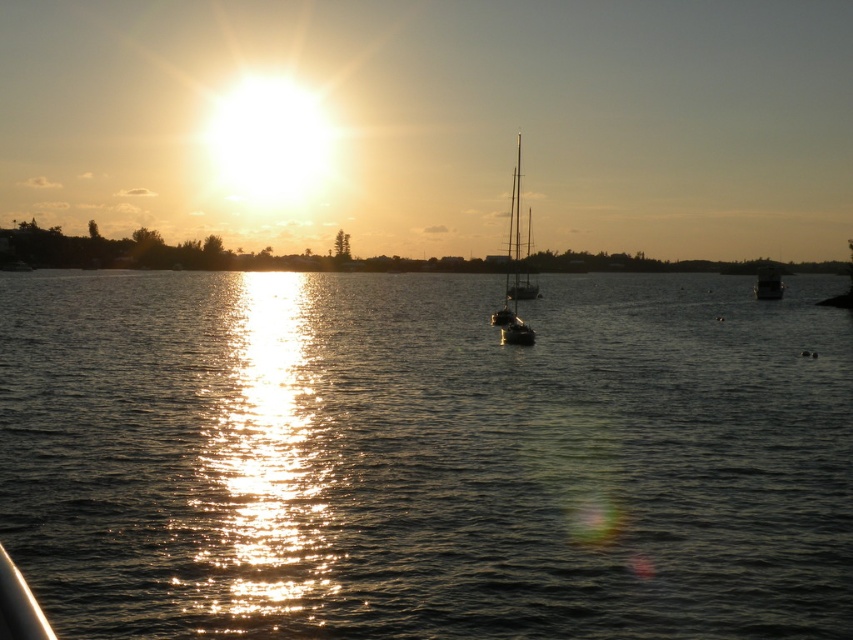
Who is more distant from viewer, (28, 532) or (776, 273)?

Positioned behind is point (776, 273).

Describe the element at coordinates (424, 456) in the screenshot. I see `shiny reflective water at center` at that location.

Does point (816, 320) come in front of point (781, 289)?

Yes, point (816, 320) is closer to viewer.

At what (x,y) coordinates should I click in order to perform the action: click on shiny reflective water at center. Please return your answer as a coordinate pair (x, y). This screenshot has height=640, width=853. Looking at the image, I should click on (424, 456).

Who is more forward, (596, 301) or (512, 236)?

Point (512, 236) is more forward.

Who is lower down, shiny reflective water at center or silhouette sailboat at center?

shiny reflective water at center is below.

Is point (814, 412) positioned before point (518, 262)?

That is True.

Where is `shiny reflective water at center`? This screenshot has height=640, width=853. shiny reflective water at center is located at coordinates (424, 456).

Who is taller, silhouette sailboat at center or metallic silver boat at right?

silhouette sailboat at center

Looking at this image, is silhouette sailboat at center taller than metallic silver boat at right?

Yes.

Find the location of a particular element. The height and width of the screenshot is (640, 853). silhouette sailboat at center is located at coordinates (514, 273).